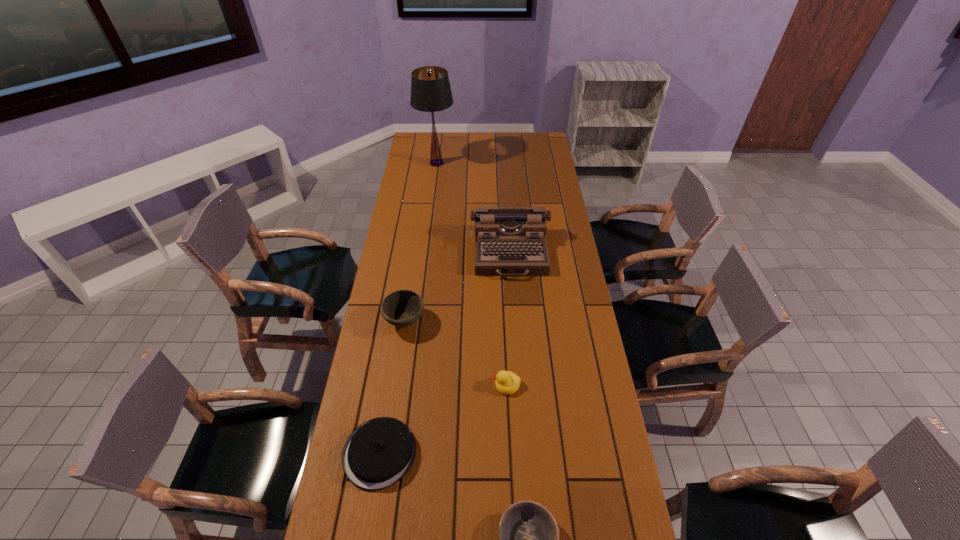
The height and width of the screenshot is (540, 960). What are the coordinates of `object at the far left corner` in the screenshot? It's located at (430, 88).

Identify the location of free spot at the left edge of the desktop. (396, 404).

I want to click on vacant area at the right edge, so click(577, 486).

This screenshot has width=960, height=540. What are the coordinates of `free space at the far right corner of the desktop` in the screenshot? It's located at (540, 149).

Where is `vacant area that lies between the fifth farthest object and the left bowl`? vacant area that lies between the fifth farthest object and the left bowl is located at coordinates tap(393, 387).

Identify the location of free spot between the fourth farthest object and the lampshade. (471, 274).

Locate an element on the screen. The image size is (960, 540). free space that is in between the farthest object and the taller bowl is located at coordinates (420, 242).

Where is `free space between the duckling and the second farthest object`? The width and height of the screenshot is (960, 540). free space between the duckling and the second farthest object is located at coordinates (508, 319).

Identify which object is the third nearest to the farthest object. Please provide its 2D coordinates. Your answer should be formatted as a tuple, i.e. [(x, y)], where the tuple contains the x and y coordinates of a point satisfying the conditions above.

[(507, 382)]

Locate which object is the fourth closest to the second nearest object. Please provide its 2D coordinates. Your answer should be formatted as a tuple, i.e. [(x, y)], where the tuple contains the x and y coordinates of a point satisfying the conditions above.

[(509, 241)]